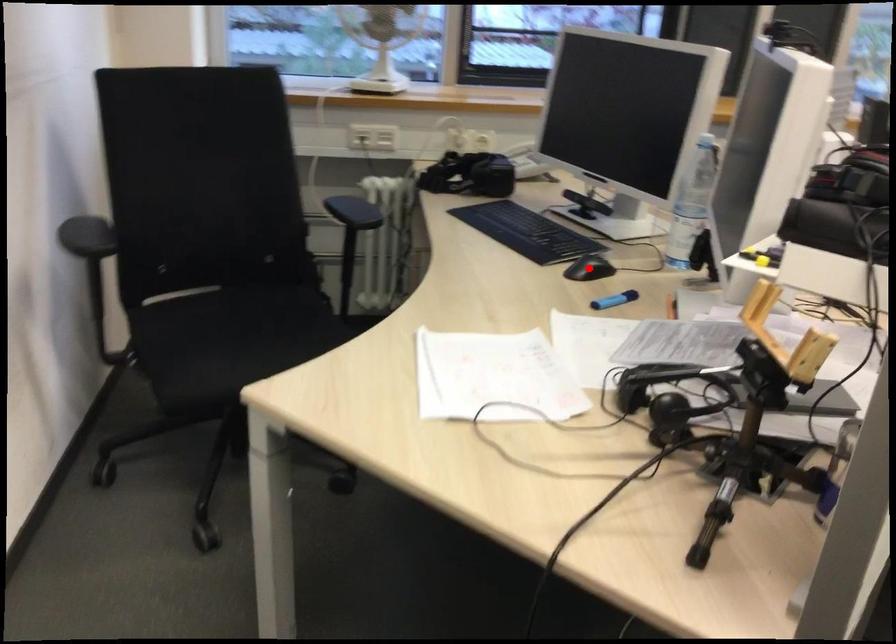
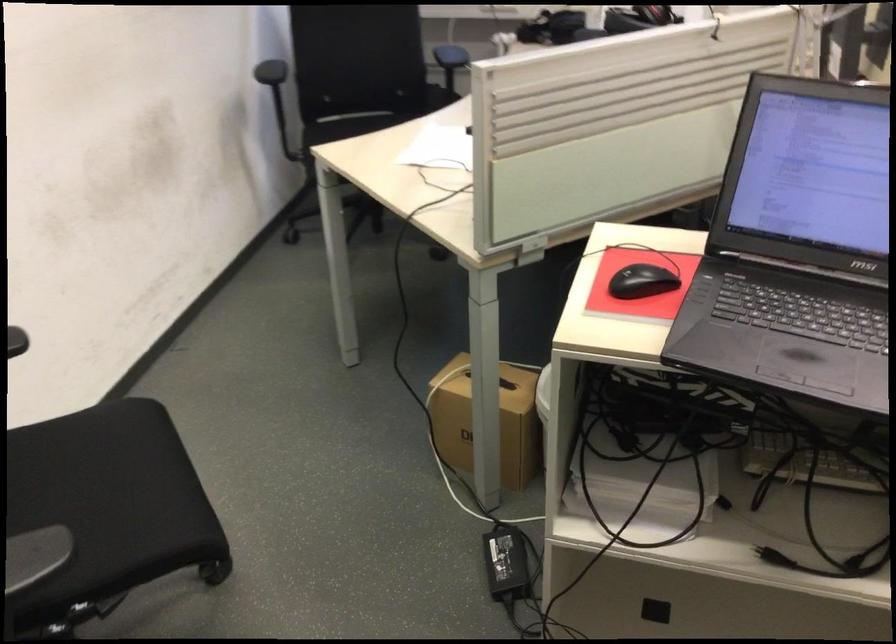
Question: I am providing you with two images of the same scene from different viewpoints. A red point is marked on the first image. Can you still see the location of the red point in image 2?

Choices:
 (A) Yes
 (B) No

Answer: (B)